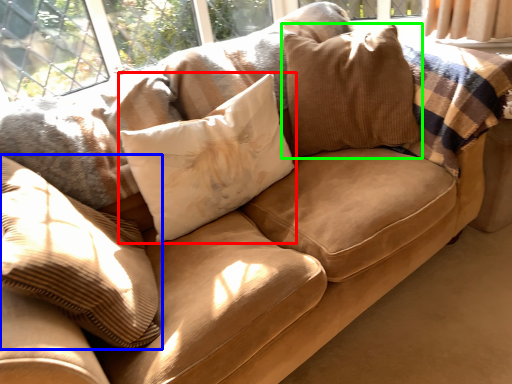
Question: Considering the real-world distances, which object is closest to pillow (highlighted by a red box)? pillow (highlighted by a blue box) or pillow (highlighted by a green box).

Choices:
 (A) pillow
 (B) pillow

Answer: (B)